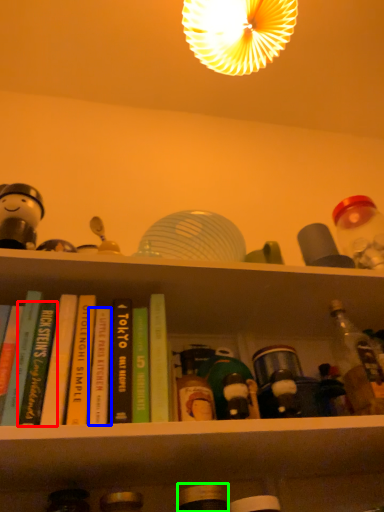
Question: Which object is positioned farthest from book (highlighted by a red box)? Select from book (highlighted by a blue box) and bottle (highlighted by a green box).

Choices:
 (A) book
 (B) bottle

Answer: (B)